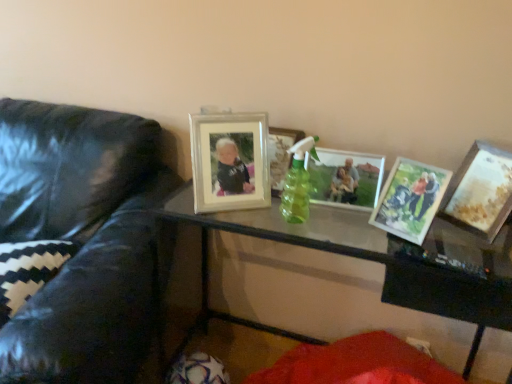
Question: From the image's perspective, does matte wooden picture frame at center right, which appears as the 2th picture frame when viewed from the right, appear lower than matte silver picture frame at center, marked as the 4th picture frame in a right-to-left arrangement?

Choices:
 (A) yes
 (B) no

Answer: (A)

Question: Can you confirm if matte wooden picture frame at center right, which appears as the 2th picture frame when viewed from the right, is thinner than matte silver picture frame at center, marked as the 4th picture frame in a right-to-left arrangement?

Choices:
 (A) no
 (B) yes

Answer: (B)

Question: Considering the relative sizes of matte wooden picture frame at center right, which appears as the 2th picture frame when viewed from the right, and matte silver picture frame at center, the 2th picture frame when ordered from left to right, in the image provided, is matte wooden picture frame at center right, which appears as the 2th picture frame when viewed from the right, taller than matte silver picture frame at center, the 2th picture frame when ordered from left to right,?

Choices:
 (A) yes
 (B) no

Answer: (A)

Question: Is matte wooden picture frame at center right, which appears as the 2th picture frame when viewed from the right, not close to matte silver picture frame at center, marked as the 4th picture frame in a right-to-left arrangement?

Choices:
 (A) yes
 (B) no

Answer: (B)

Question: From a real-world perspective, does matte wooden picture frame at center right, the fourth picture frame from the left, stand above matte silver picture frame at center, the 2th picture frame when ordered from left to right?

Choices:
 (A) yes
 (B) no

Answer: (B)

Question: Considering the relative positions of matte wooden picture frame at center right, which appears as the 2th picture frame when viewed from the right, and matte silver picture frame at center, marked as the 4th picture frame in a right-to-left arrangement, in the image provided, is matte wooden picture frame at center right, which appears as the 2th picture frame when viewed from the right, to the left of matte silver picture frame at center, marked as the 4th picture frame in a right-to-left arrangement, from the viewer's perspective?

Choices:
 (A) no
 (B) yes

Answer: (A)

Question: From a real-world perspective, is matte silver picture frame at center, the 2th picture frame when ordered from left to right, positioned over wooden photo frame at right, the first picture frame positioned from the right, based on gravity?

Choices:
 (A) no
 (B) yes

Answer: (A)

Question: Is matte silver picture frame at center, the 2th picture frame when ordered from left to right, to the left of wooden photo frame at right, the first picture frame positioned from the right, from the viewer's perspective?

Choices:
 (A) yes
 (B) no

Answer: (A)

Question: Does matte silver picture frame at center, marked as the 4th picture frame in a right-to-left arrangement, have a smaller size compared to wooden photo frame at right, the first picture frame positioned from the right?

Choices:
 (A) yes
 (B) no

Answer: (A)

Question: Is matte silver picture frame at center, the 2th picture frame when ordered from left to right, to the right of wooden photo frame at right, the first picture frame positioned from the right, from the viewer's perspective?

Choices:
 (A) no
 (B) yes

Answer: (A)

Question: Is matte silver picture frame at center, the 2th picture frame when ordered from left to right, oriented towards wooden photo frame at right, the first picture frame positioned from the right?

Choices:
 (A) yes
 (B) no

Answer: (B)

Question: Is matte silver picture frame at center, marked as the 4th picture frame in a right-to-left arrangement, shorter than wooden photo frame at right, the fifth picture frame when ordered from left to right?

Choices:
 (A) no
 (B) yes

Answer: (B)

Question: Is matte silver picture frame at center, marked as the 4th picture frame in a right-to-left arrangement, to the right of transparent glass table at center from the viewer's perspective?

Choices:
 (A) no
 (B) yes

Answer: (A)